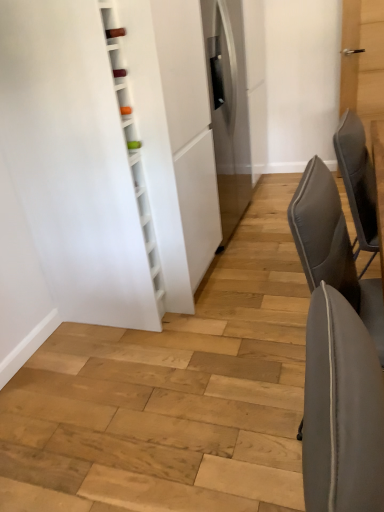
Question: Is gray fabric chair at right, which is the second chair in top-to-bottom order, oriented towards gray fabric chair at right, acting as the 2th chair starting from the bottom?

Choices:
 (A) yes
 (B) no

Answer: (B)

Question: Is gray fabric chair at right, acting as the 1th chair starting from the bottom, positioned in front of gray fabric chair at right, the first chair when ordered from top to bottom?

Choices:
 (A) yes
 (B) no

Answer: (A)

Question: Can you confirm if gray fabric chair at right, which is the second chair in top-to-bottom order, is shorter than gray fabric chair at right, acting as the 2th chair starting from the bottom?

Choices:
 (A) no
 (B) yes

Answer: (A)

Question: Does gray fabric chair at right, acting as the 1th chair starting from the bottom, have a greater width compared to gray fabric chair at right, acting as the 2th chair starting from the bottom?

Choices:
 (A) yes
 (B) no

Answer: (A)

Question: From a real-world perspective, is gray fabric chair at right, acting as the 1th chair starting from the bottom, located beneath gray fabric chair at right, acting as the 2th chair starting from the bottom?

Choices:
 (A) no
 (B) yes

Answer: (B)

Question: Does gray fabric chair at right, which is the second chair in top-to-bottom order, have a lesser width compared to gray fabric chair at right, the first chair when ordered from top to bottom?

Choices:
 (A) no
 (B) yes

Answer: (A)

Question: Is gray fabric chair at right, the first chair when ordered from top to bottom, positioned beyond the bounds of gray fabric chair at right, acting as the 1th chair starting from the bottom?

Choices:
 (A) no
 (B) yes

Answer: (B)

Question: From the image's perspective, is gray fabric chair at right, acting as the 2th chair starting from the bottom, below gray fabric chair at right, which is the second chair in top-to-bottom order?

Choices:
 (A) yes
 (B) no

Answer: (B)

Question: Is gray fabric chair at right, acting as the 2th chair starting from the bottom, to the right of gray fabric chair at right, acting as the 1th chair starting from the bottom, from the viewer's perspective?

Choices:
 (A) no
 (B) yes

Answer: (B)

Question: Is gray fabric chair at right, the first chair when ordered from top to bottom, facing away from gray fabric chair at right, acting as the 1th chair starting from the bottom?

Choices:
 (A) yes
 (B) no

Answer: (B)

Question: Does gray fabric chair at right, the first chair when ordered from top to bottom, have a lesser height compared to gray fabric chair at right, which is the second chair in top-to-bottom order?

Choices:
 (A) no
 (B) yes

Answer: (B)

Question: From the image's perspective, is gray fabric chair at right, acting as the 1th chair starting from the bottom, positioned above or below gray fabric chair at right, acting as the 2th chair starting from the bottom?

Choices:
 (A) below
 (B) above

Answer: (A)